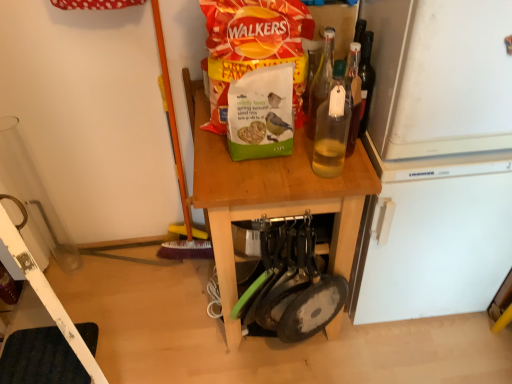
Find the location of a particular element. free space on the front side of translucent glass bottle at center, which appears as the 2th bottle when viewed from the front is located at coordinates (318, 173).